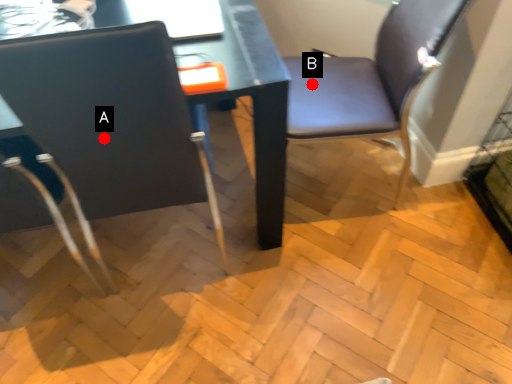
Question: Two points are circled on the image, labeled by A and B beside each circle. Which point is closer to the camera?

Choices:
 (A) A is closer
 (B) B is closer

Answer: (A)